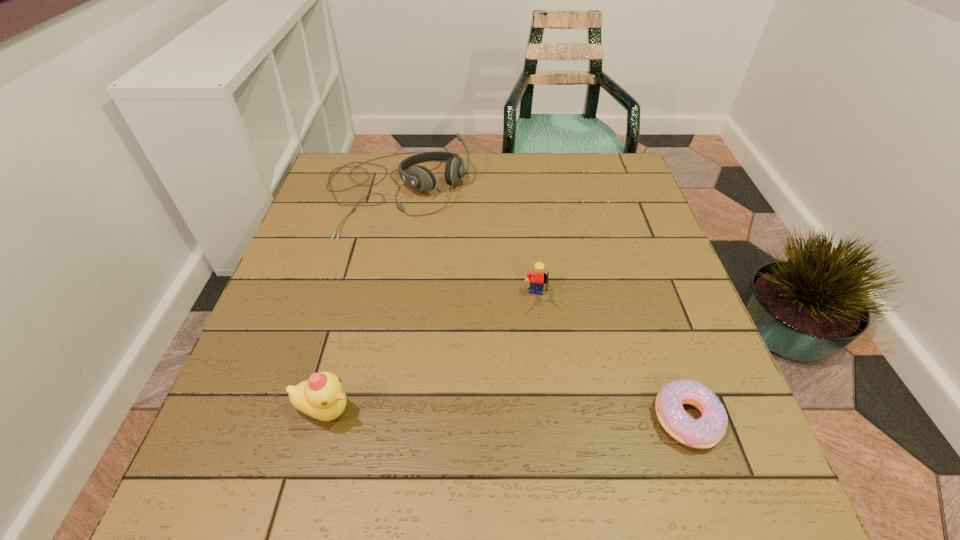
Where is `duckling`? duckling is located at coordinates (321, 396).

The image size is (960, 540). I want to click on the rightmost object, so click(x=705, y=432).

I want to click on the shortest object, so click(705, 432).

Locate an element on the screen. the second object from right to left is located at coordinates (537, 278).

You are a GUI agent. You are given a task and a screenshot of the screen. Output one action in this format:
    pyautogui.click(x=<x>, y=<y>)
    Task: Click on the second farthest object
    
    Given the screenshot: What is the action you would take?
    pyautogui.click(x=537, y=278)

Where is `the farthest object`? The width and height of the screenshot is (960, 540). the farthest object is located at coordinates (420, 178).

Locate an element on the screen. free space located on the front-facing side of the duckling is located at coordinates (408, 410).

Find the location of a particular element. The height and width of the screenshot is (540, 960). vacant region located 0.070m on the left of the doughnut is located at coordinates (613, 418).

Where is `blank space located 0.280m on the front-facing side of the Lego`? Image resolution: width=960 pixels, height=540 pixels. blank space located 0.280m on the front-facing side of the Lego is located at coordinates (510, 436).

Find the location of a particular element. vacant region located 0.100m on the front-facing side of the Lego is located at coordinates (527, 350).